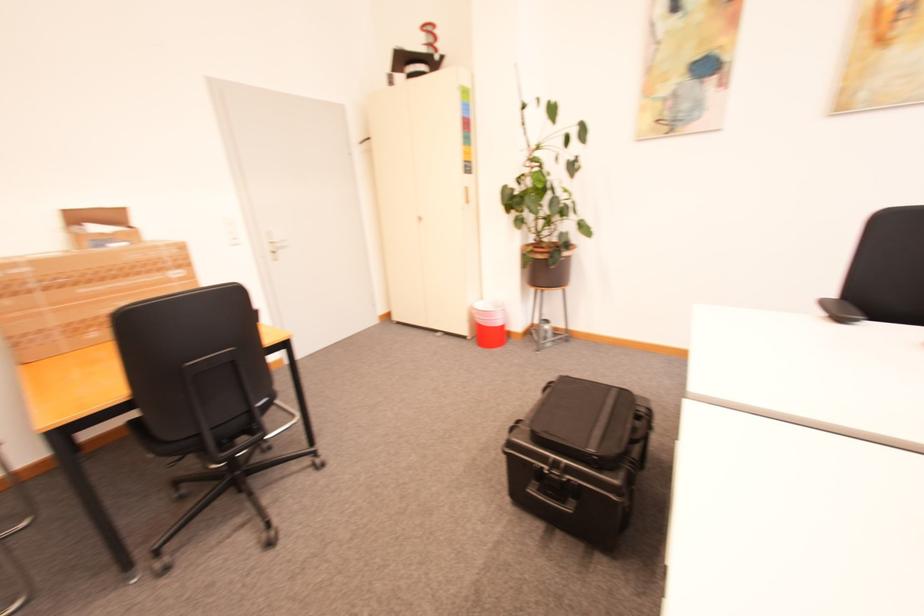
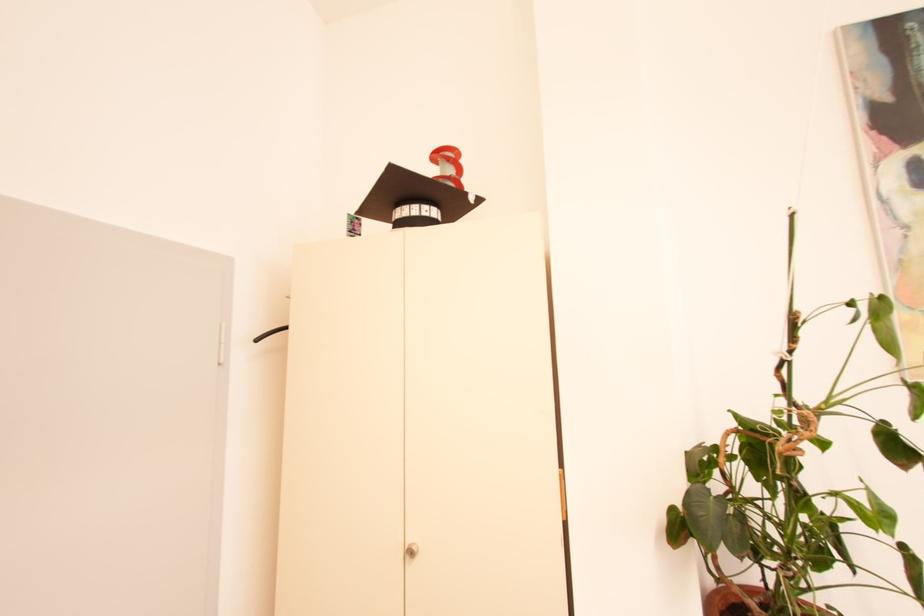
The point at (x=444, y=58) is marked in the first image. Where is the corresponding point in the second image?

(478, 199)